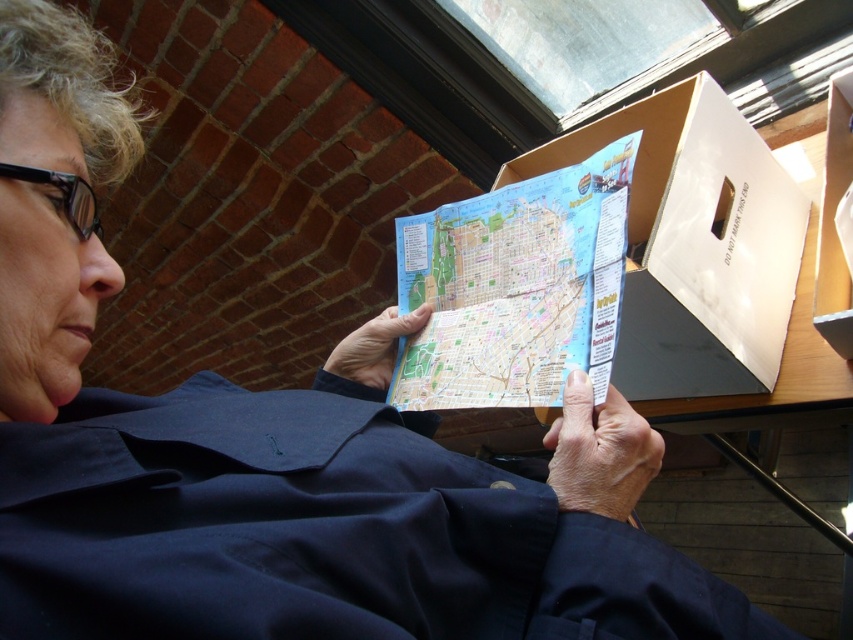
You are a delivery person who needs to place a package on the navy blue fabric at center and the colorful paper map at center. Which object should you avoid covering to ensure the map remains visible?

You should avoid covering the colorful paper map at center because the navy blue fabric at center is in front of it, so placing the package on the navy blue fabric at center would block the view of the map.

You are a delivery person who needs to place a small package on the navy blue fabric at center without covering the colorful paper map at center. Based on the scene, is this possible?

The navy blue fabric at center is below the colorful paper map at center, so placing the package on the navy blue fabric at center would not cover the map since it is positioned beneath it.